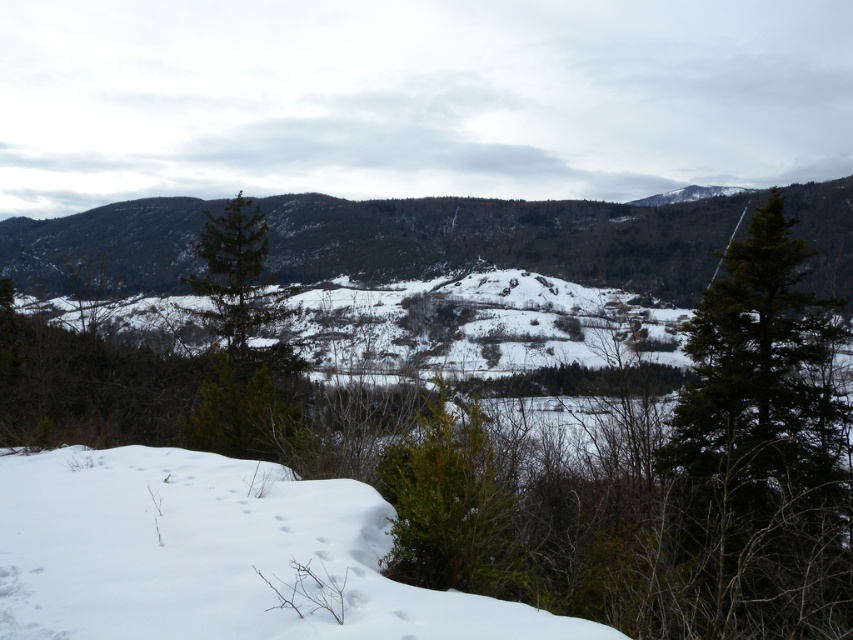
Is point (178, 550) farther from camera compared to point (776, 285)?

No, it is not.

You are a GUI agent. You are given a task and a screenshot of the screen. Output one action in this format:
    pyautogui.click(x=<x>, y=<y>)
    Task: Click on the white snow at lower left
    The height and width of the screenshot is (640, 853).
    Given the screenshot: What is the action you would take?
    pyautogui.click(x=215, y=554)

I want to click on white snow at lower left, so click(x=215, y=554).

Is green matte tree at right to the right of green matte tree at center from the viewer's perspective?

Correct, you'll find green matte tree at right to the right of green matte tree at center.

Which of these two, green matte tree at right or green matte tree at center, stands taller?

green matte tree at center is taller.

Which is in front, point (831, 435) or point (235, 349)?

Point (831, 435) is more forward.

Where is `green matte tree at right`? The image size is (853, 640). green matte tree at right is located at coordinates (759, 388).

Which is more to the left, white snow at lower left or green matte tree at center?

Positioned to the left is green matte tree at center.

Can you confirm if white snow at lower left is positioned to the left of green matte tree at center?

In fact, white snow at lower left is to the right of green matte tree at center.

The image size is (853, 640). Identify the location of white snow at lower left. (215, 554).